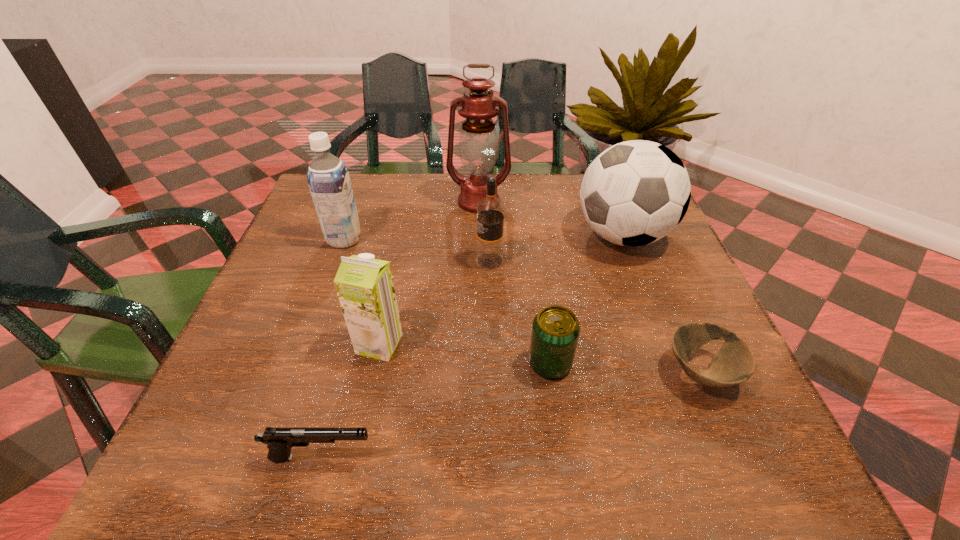
At what (x,y) coordinates should I click in order to perform the action: click on empty location between the vodka and the gun. Please return your answer as a coordinate pair (x, y). Looking at the image, I should click on (405, 359).

Where is `unoccupied position between the soccer ball and the right soya milk`? unoccupied position between the soccer ball and the right soya milk is located at coordinates (501, 290).

This screenshot has height=540, width=960. Find the location of `free space between the soccer ball and the shortest object`. free space between the soccer ball and the shortest object is located at coordinates (661, 304).

Find the location of a particular element. The image size is (960, 540). vacant area between the vodka and the shorter soya milk is located at coordinates point(435,302).

The width and height of the screenshot is (960, 540). What are the coordinates of `vacant area that lies between the third object from right to left and the vodka` in the screenshot? It's located at (519, 312).

Image resolution: width=960 pixels, height=540 pixels. In order to click on vacant area that lies between the second shortest object and the right soya milk in this screenshot , I will do `click(350, 401)`.

Identify the location of vacant region between the oil lamp and the soccer ball. (550, 219).

Locate an element on the screen. vacant space in between the oil lamp and the taller soya milk is located at coordinates coord(412,220).

Choose which object is the third nearest neighbor to the sixth object from left to right. Please provide its 2D coordinates. Your answer should be formatted as a tuple, i.e. [(x, y)], where the tuple contains the x and y coordinates of a point satisfying the conditions above.

[(634, 193)]

I want to click on the third closest object to the second shortest object, so click(490, 210).